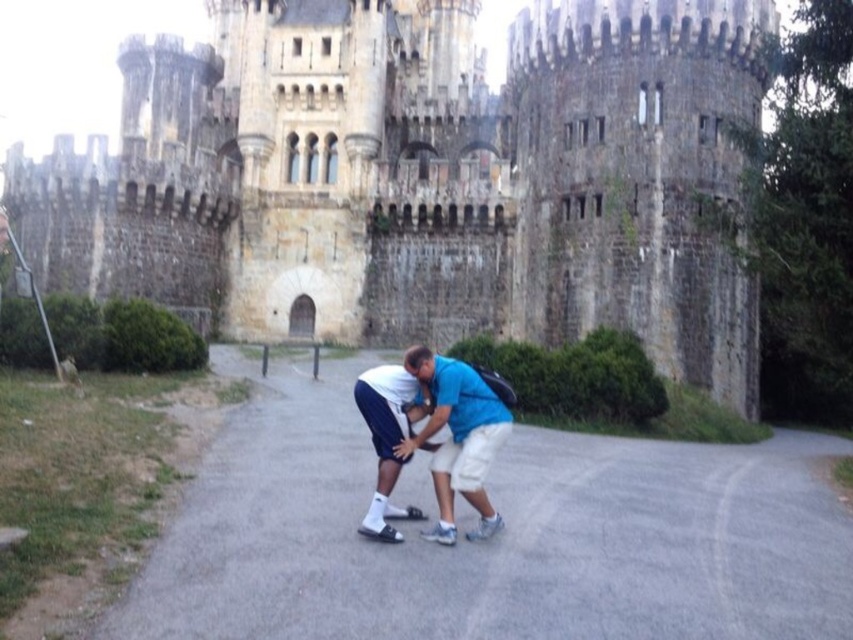
Question: Which point is farther to the camera?

Choices:
 (A) white matte shorts at center
 (B) blue cotton shirt at center

Answer: (A)

Question: Observing the image, what is the correct spatial positioning of blue cotton shirt at center in reference to white matte shorts at center?

Choices:
 (A) below
 (B) above

Answer: (B)

Question: Among these points, which one is farthest from the camera?

Choices:
 (A) (223, 211)
 (B) (431, 531)

Answer: (A)

Question: Does blue cotton shirt at center appear over white matte shorts at center?

Choices:
 (A) yes
 (B) no

Answer: (A)

Question: Among these objects, which one is nearest to the camera?

Choices:
 (A) blue cotton shirt at center
 (B) white matte shorts at center

Answer: (A)

Question: Is blue cotton shirt at center below white matte shorts at center?

Choices:
 (A) no
 (B) yes

Answer: (A)